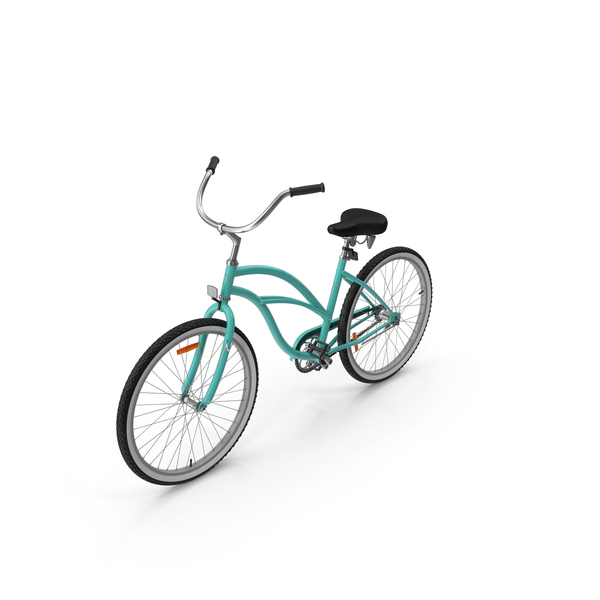
Where is `light`? The width and height of the screenshot is (600, 600). light is located at coordinates (211, 294).